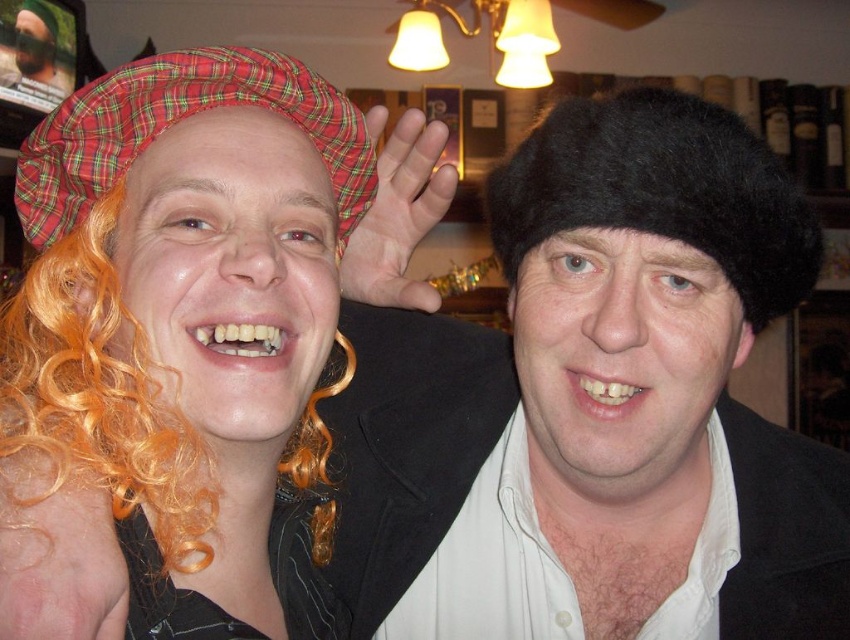
Is orange curly wig at left in front of black fuzzy hat at upper right?

Yes, it is in front of black fuzzy hat at upper right.

Is orange curly wig at left positioned behind black fuzzy hat at upper right?

No.

Who is more forward, (x=178, y=456) or (x=630, y=179)?

Point (x=630, y=179) is in front.

Image resolution: width=850 pixels, height=640 pixels. In order to click on orange curly wig at left in this screenshot , I will do `click(99, 392)`.

Between orange curly wig at left and plaid fabric hat at upper left, which one has less height?

With less height is plaid fabric hat at upper left.

Is orange curly wig at left to the right of plaid fabric hat at upper left from the viewer's perspective?

In fact, orange curly wig at left is to the left of plaid fabric hat at upper left.

Between point (41, 440) and point (44, 200), which one is positioned in front?

Point (41, 440) is in front.

Locate an element on the screen. orange curly wig at left is located at coordinates (99, 392).

Does point (639, 170) come closer to viewer compared to point (103, 148)?

That is True.

Is point (536, 138) farther from camera compared to point (21, 163)?

Yes, it is behind point (21, 163).

Is point (762, 266) positioned before point (340, 108)?

That is True.

Find the location of `black fuzzy hat at upper right`. black fuzzy hat at upper right is located at coordinates (661, 189).